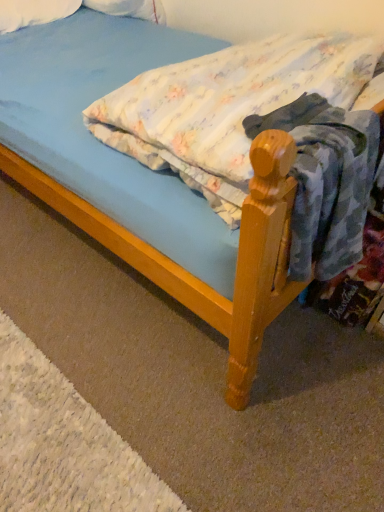
Question: From a real-world perspective, is light blue fabric mattress at center below white soft pillow at upper left?

Choices:
 (A) yes
 (B) no

Answer: (B)

Question: Considering the relative positions of light blue fabric mattress at center and white soft pillow at upper left in the image provided, is light blue fabric mattress at center to the right of white soft pillow at upper left from the viewer's perspective?

Choices:
 (A) yes
 (B) no

Answer: (A)

Question: Is light blue fabric mattress at center facing away from white soft pillow at upper left?

Choices:
 (A) no
 (B) yes

Answer: (A)

Question: From the image's perspective, is light blue fabric mattress at center below white soft pillow at upper left?

Choices:
 (A) no
 (B) yes

Answer: (B)

Question: Are light blue fabric mattress at center and white soft pillow at upper left located far from each other?

Choices:
 (A) yes
 (B) no

Answer: (A)

Question: Does light blue fabric mattress at center have a lesser height compared to white soft pillow at upper left?

Choices:
 (A) no
 (B) yes

Answer: (A)

Question: Does white soft pillow at upper left have a greater width compared to light blue fabric mattress at center?

Choices:
 (A) yes
 (B) no

Answer: (B)

Question: From the image's perspective, is white soft pillow at upper left on top of light blue fabric mattress at center?

Choices:
 (A) no
 (B) yes

Answer: (B)

Question: Can you confirm if white soft pillow at upper left is shorter than light blue fabric mattress at center?

Choices:
 (A) yes
 (B) no

Answer: (A)

Question: From a real-world perspective, is white soft pillow at upper left located higher than light blue fabric mattress at center?

Choices:
 (A) yes
 (B) no

Answer: (B)

Question: From the image's perspective, is white soft pillow at upper left beneath light blue fabric mattress at center?

Choices:
 (A) no
 (B) yes

Answer: (A)

Question: Is white soft pillow at upper left beside light blue fabric mattress at center?

Choices:
 (A) no
 (B) yes

Answer: (A)

Question: Considering their positions, is light blue fabric mattress at center located in front of or behind white soft pillow at upper left?

Choices:
 (A) front
 (B) behind

Answer: (A)